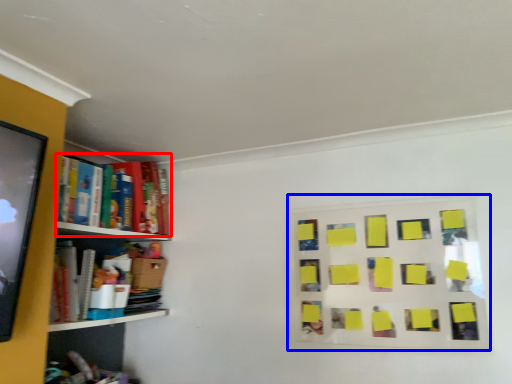
Question: Among these objects, which one is farthest to the camera, book (highlighted by a red box) or bulletin board (highlighted by a blue box)?

Choices:
 (A) book
 (B) bulletin board

Answer: (A)